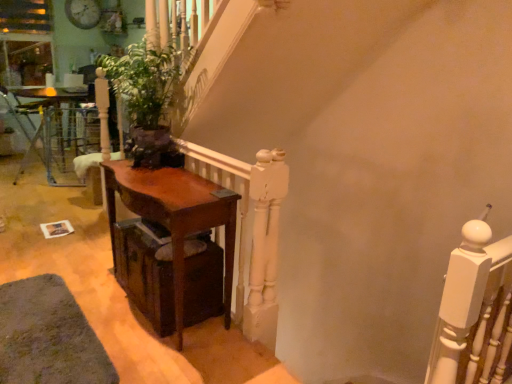
Question: Is mahogany wood table at center, the 1th table from the front, looking in the opposite direction of dark wood drawer at lower left?

Choices:
 (A) no
 (B) yes

Answer: (B)

Question: From the image's perspective, is mahogany wood table at center, the second table from the back, above dark wood drawer at lower left?

Choices:
 (A) yes
 (B) no

Answer: (A)

Question: Would you say mahogany wood table at center, the 1th table from the front, contains dark wood drawer at lower left?

Choices:
 (A) yes
 (B) no

Answer: (A)

Question: Is mahogany wood table at center, the 1th table from the front, at the right side of dark wood drawer at lower left?

Choices:
 (A) yes
 (B) no

Answer: (B)

Question: Considering the relative sizes of mahogany wood table at center, marked as the first table in a right-to-left arrangement, and dark wood drawer at lower left in the image provided, is mahogany wood table at center, marked as the first table in a right-to-left arrangement, wider than dark wood drawer at lower left?

Choices:
 (A) no
 (B) yes

Answer: (A)

Question: Can you confirm if mahogany wood table at center, placed as the second table when sorted from left to right, is bigger than dark wood drawer at lower left?

Choices:
 (A) yes
 (B) no

Answer: (A)

Question: From the image's perspective, does white painted wood at upper right appear higher than green matte plant at center?

Choices:
 (A) yes
 (B) no

Answer: (B)

Question: Is white painted wood at upper right positioned with its back to green matte plant at center?

Choices:
 (A) no
 (B) yes

Answer: (A)

Question: From a real-world perspective, is white painted wood at upper right beneath green matte plant at center?

Choices:
 (A) no
 (B) yes

Answer: (B)

Question: From the image's perspective, is white painted wood at upper right beneath green matte plant at center?

Choices:
 (A) yes
 (B) no

Answer: (A)

Question: Can you confirm if white painted wood at upper right is taller than green matte plant at center?

Choices:
 (A) yes
 (B) no

Answer: (A)

Question: Does white painted wood at upper right come behind green matte plant at center?

Choices:
 (A) no
 (B) yes

Answer: (A)

Question: Does white painted wood at upper right have a lesser width compared to mahogany wood table at center, placed as the second table when sorted from left to right?

Choices:
 (A) no
 (B) yes

Answer: (B)